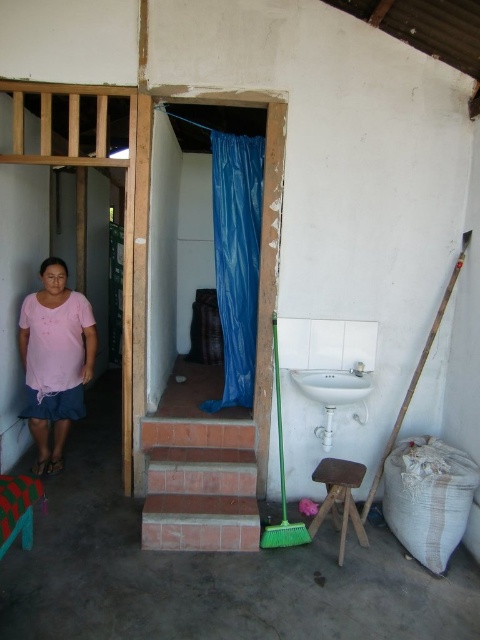
Between blue plastic curtain at center and pink fabric skirt at lower left, which one has less height?

pink fabric skirt at lower left is shorter.

Who is positioned more to the left, blue plastic curtain at center or pink fabric skirt at lower left?

pink fabric skirt at lower left

Does point (237, 385) come in front of point (51, 308)?

No, it is not.

At what (x,y) coordinates should I click in order to perform the action: click on blue plastic curtain at center. Please return your answer as a coordinate pair (x, y). This screenshot has width=480, height=640. Looking at the image, I should click on (237, 259).

Which is more to the left, pink fabric skirt at lower left or white glossy sink at center?

Positioned to the left is pink fabric skirt at lower left.

Does pink fabric skirt at lower left appear over white glossy sink at center?

Correct, pink fabric skirt at lower left is located above white glossy sink at center.

At what (x,y) coordinates should I click in order to perform the action: click on pink fabric skirt at lower left. Please return your answer as a coordinate pair (x, y). The image size is (480, 640). Looking at the image, I should click on (55, 358).

Can you confirm if brick stairs at lower left is positioned below brown wooden stool at lower center?

No.

Image resolution: width=480 pixels, height=640 pixels. I want to click on brick stairs at lower left, so click(x=200, y=484).

You are a GUI agent. You are given a task and a screenshot of the screen. Output one action in this format:
    pyautogui.click(x=<x>, y=<y>)
    Task: Click on the brick stairs at lower left
    The height and width of the screenshot is (640, 480).
    Given the screenshot: What is the action you would take?
    pyautogui.click(x=200, y=484)